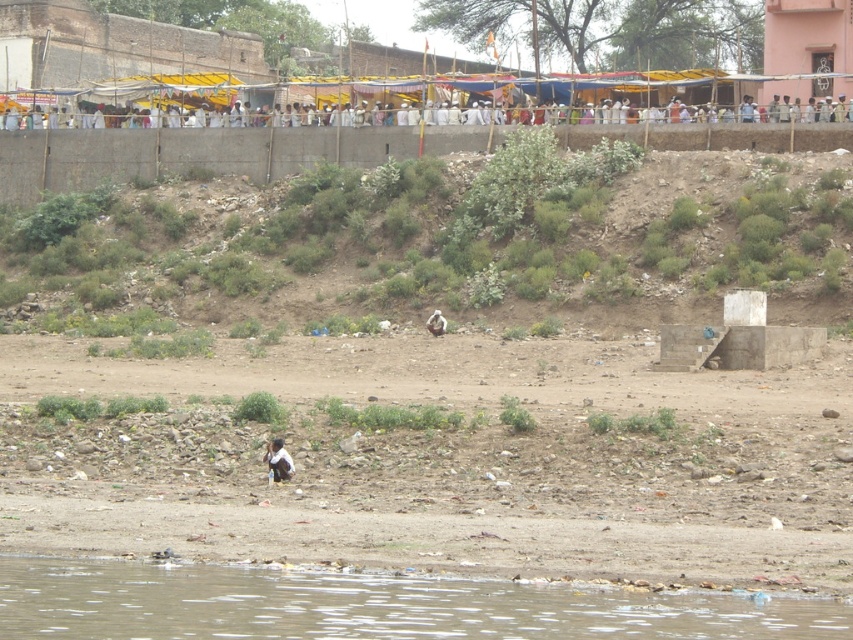
Can you confirm if brown dirt field at lower center is wider than brown sedimentary river at lower left?

Correct, the width of brown dirt field at lower center exceeds that of brown sedimentary river at lower left.

Find the location of a particular element. This screenshot has width=853, height=640. brown dirt field at lower center is located at coordinates pyautogui.click(x=439, y=460).

Can you confirm if brown dirt field at lower center is taller than white clothed people at upper center?

Yes, brown dirt field at lower center is taller than white clothed people at upper center.

Who is shorter, brown dirt field at lower center or white clothed people at upper center?

white clothed people at upper center

At what (x,y) coordinates should I click in order to perform the action: click on brown dirt field at lower center. Please return your answer as a coordinate pair (x, y). The image size is (853, 640). Looking at the image, I should click on (439, 460).

Is brown sedimentary river at lower left closer to camera compared to white clothed people at upper center?

Yes, brown sedimentary river at lower left is in front of white clothed people at upper center.

What do you see at coordinates (373, 604) in the screenshot?
I see `brown sedimentary river at lower left` at bounding box center [373, 604].

Measure the distance between brown sedimentary river at lower left and camera.

brown sedimentary river at lower left is 134.03 feet away from camera.

Locate an element on the screen. This screenshot has width=853, height=640. brown sedimentary river at lower left is located at coordinates (373, 604).